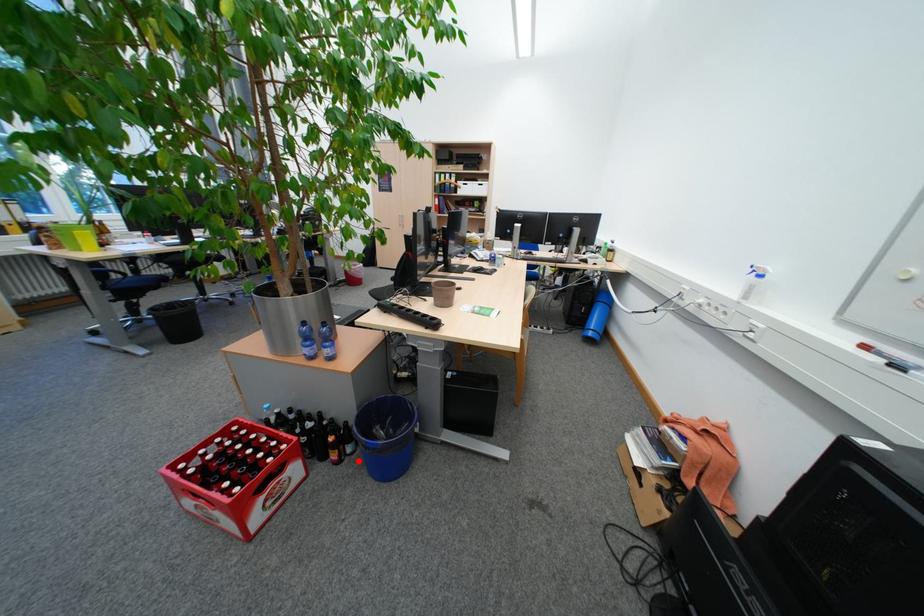
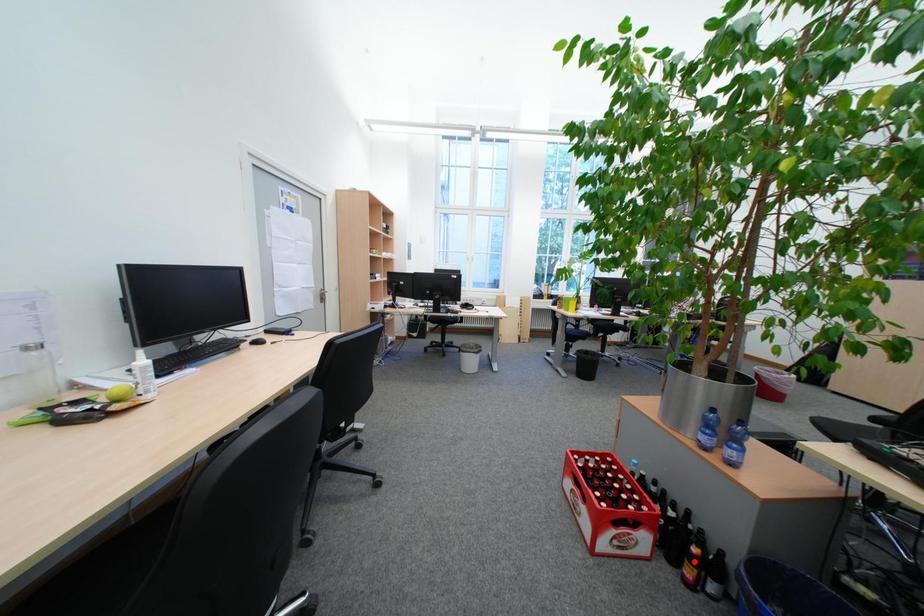
I am providing you with two images of the same scene from different viewpoints. A red point is marked on the first image and another point is marked on the second image. Is the red point in image1 aligned with the point shown in image2?

No